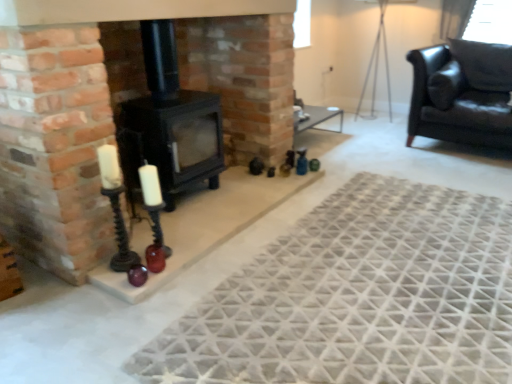
In order to click on free space to the left of black leather couch at upper right in this screenshot , I will do `click(369, 149)`.